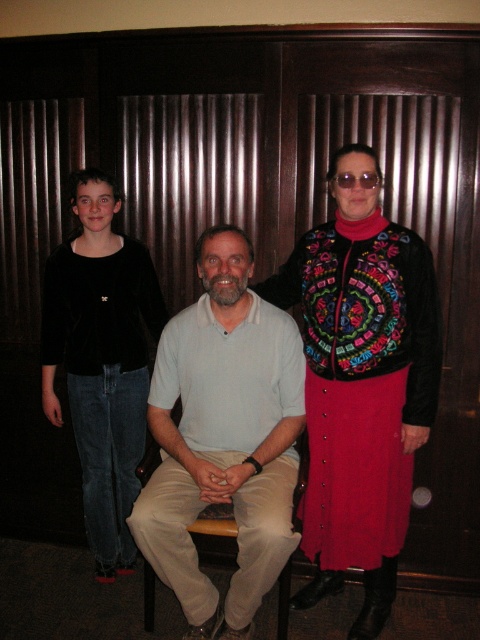
You are standing in the room and want to place a small potted plant between the two points, point [294,381] and point [110,278]. Which point should the plant be closer to so it is positioned in front of the other point?

The plant should be closer to point [110,278] because point [294,381] is in front of point [110,278]. To place the plant in front of the other point, it should be near the point that is further back, which is point [110,278].

In the scene shown: You are a photographer setting up a shoot in a room with dark wooden paneling. You notice the light beige cotton shirt at center and the transparent plastic goggles at upper center. Which object is closer to the camera?

The light beige cotton shirt at center is closer to the camera because it is in front of the transparent plastic goggles at upper center.

You are a photographer setting up a shoot in a room with dark wooden paneling. You notice the light beige cotton shirt at center and the transparent plastic goggles at upper center. Which object is positioned higher in the image?

The transparent plastic goggles at upper center are positioned higher than the light beige cotton shirt at center.